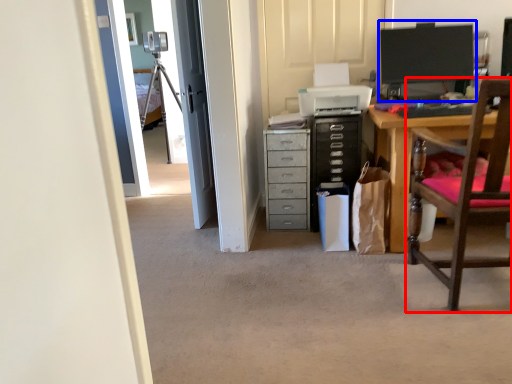
Question: Among these objects, which one is nearest to the camera, chair (highlighted by a red box) or computer monitor (highlighted by a blue box)?

Choices:
 (A) chair
 (B) computer monitor

Answer: (A)